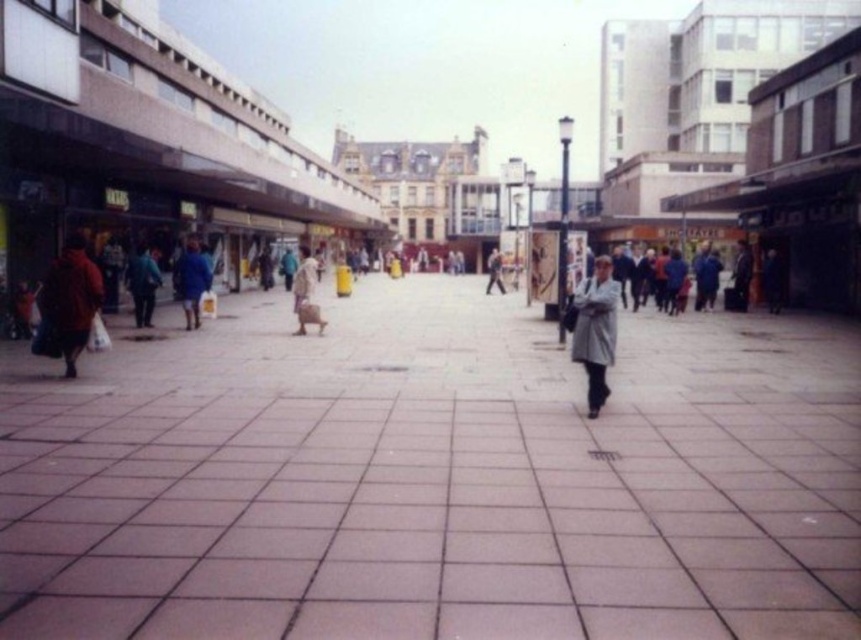
Is light gray coat at center above light brown fabric bag at center?

Actually, light gray coat at center is below light brown fabric bag at center.

Which is more to the left, light gray coat at center or light brown fabric bag at center?

From the viewer's perspective, light brown fabric bag at center appears more on the left side.

Which is behind, point (575, 355) or point (302, 317)?

Point (302, 317)

You are a GUI agent. You are given a task and a screenshot of the screen. Output one action in this format:
    pyautogui.click(x=<x>, y=<y>)
    Task: Click on the light gray coat at center
    
    Given the screenshot: What is the action you would take?
    pyautogui.click(x=596, y=330)

Which of these two, light brown fabric bag at center or matte gray coat at center, stands taller?

Standing taller between the two is matte gray coat at center.

Does light brown fabric bag at center have a lesser width compared to matte gray coat at center?

No.

You are a GUI agent. You are given a task and a screenshot of the screen. Output one action in this format:
    pyautogui.click(x=<x>, y=<y>)
    Task: Click on the light brown fabric bag at center
    The width and height of the screenshot is (861, 640).
    Given the screenshot: What is the action you would take?
    pyautogui.click(x=307, y=292)

The height and width of the screenshot is (640, 861). Find the location of `light brown fabric bag at center`. light brown fabric bag at center is located at coordinates click(307, 292).

Does point (593, 300) come farther from viewer compared to point (499, 266)?

No, it is not.

Is light gray coat at center positioned at the back of matte gray coat at center?

No, light gray coat at center is closer to the viewer.

Describe the element at coordinates (596, 330) in the screenshot. The width and height of the screenshot is (861, 640). I see `light gray coat at center` at that location.

Where is `light gray coat at center`? light gray coat at center is located at coordinates (596, 330).